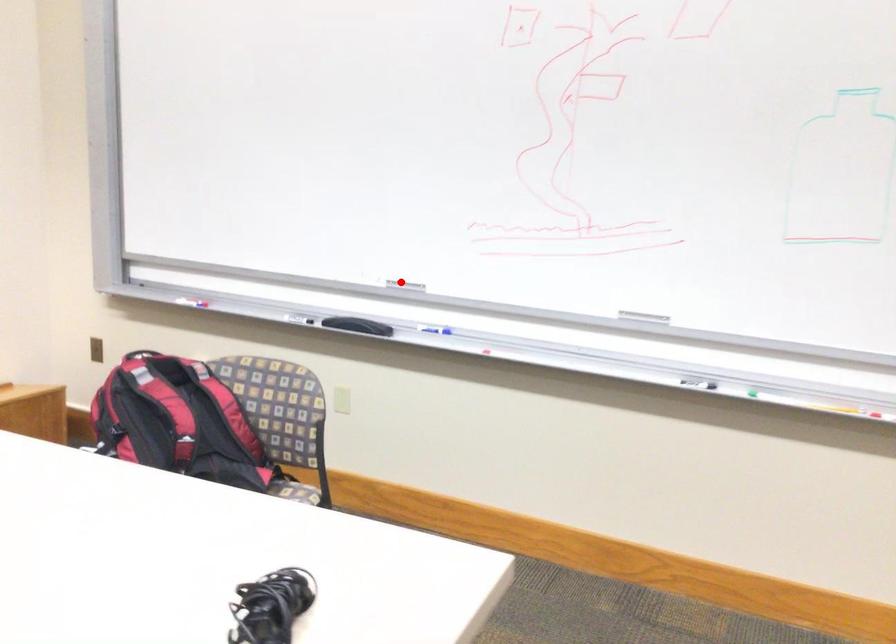
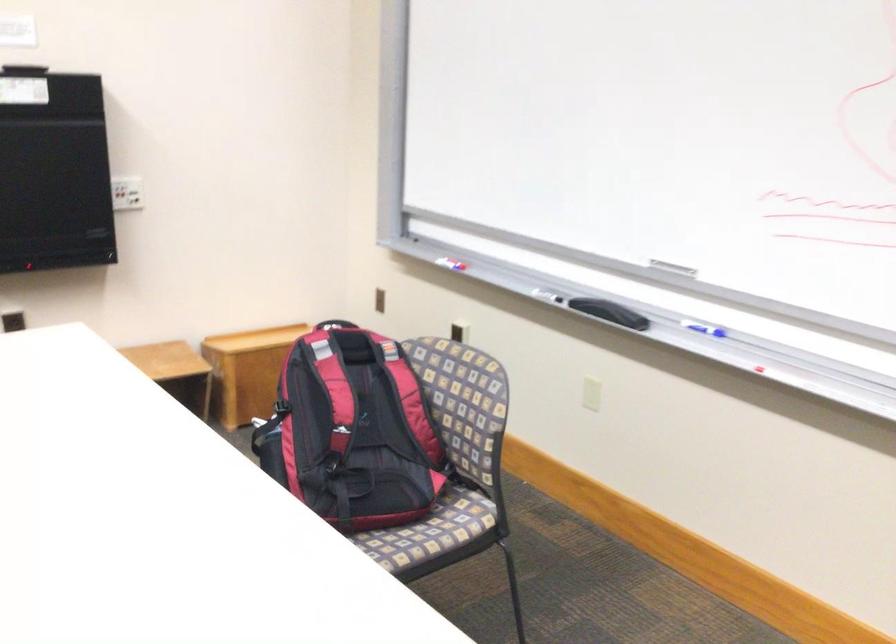
Where in the second image is the point corresponding to the highlighted location from the first image?

(672, 267)